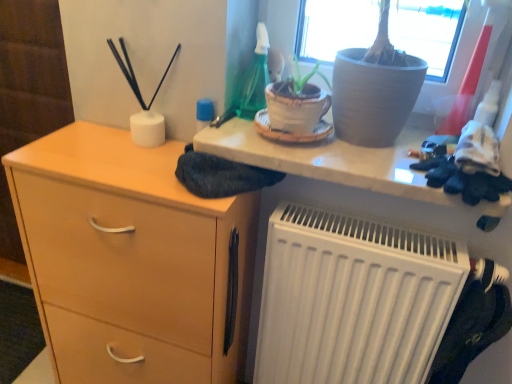
Question: Would you say white matte radiator at lower right is part of light wood/finish chest of drawers at left's contents?

Choices:
 (A) no
 (B) yes

Answer: (A)

Question: Considering the relative sizes of light wood/finish chest of drawers at left and white matte radiator at lower right in the image provided, is light wood/finish chest of drawers at left bigger than white matte radiator at lower right?

Choices:
 (A) no
 (B) yes

Answer: (B)

Question: Is light wood/finish chest of drawers at left outside of white matte radiator at lower right?

Choices:
 (A) yes
 (B) no

Answer: (A)

Question: From a real-world perspective, is light wood/finish chest of drawers at left physically below white matte radiator at lower right?

Choices:
 (A) yes
 (B) no

Answer: (A)

Question: Is white matte radiator at lower right at the back of light wood/finish chest of drawers at left?

Choices:
 (A) no
 (B) yes

Answer: (A)

Question: Can you confirm if light wood/finish chest of drawers at left is positioned to the left of white matte radiator at lower right?

Choices:
 (A) yes
 (B) no

Answer: (A)

Question: From a real-world perspective, is light wood/finish chest of drawers at left located beneath matte gray pot at upper center?

Choices:
 (A) yes
 (B) no

Answer: (A)

Question: Can you confirm if light wood/finish chest of drawers at left is shorter than matte gray pot at upper center?

Choices:
 (A) yes
 (B) no

Answer: (B)

Question: Does light wood/finish chest of drawers at left have a lesser width compared to matte gray pot at upper center?

Choices:
 (A) yes
 (B) no

Answer: (A)

Question: Is the surface of light wood/finish chest of drawers at left in direct contact with matte gray pot at upper center?

Choices:
 (A) yes
 (B) no

Answer: (B)

Question: Is light wood/finish chest of drawers at left closer to camera compared to matte gray pot at upper center?

Choices:
 (A) no
 (B) yes

Answer: (A)

Question: Could you tell me if light wood/finish chest of drawers at left is facing matte gray pot at upper center?

Choices:
 (A) yes
 (B) no

Answer: (B)

Question: From the image's perspective, is matte gray pot at upper center below white matte radiator at lower right?

Choices:
 (A) no
 (B) yes

Answer: (A)